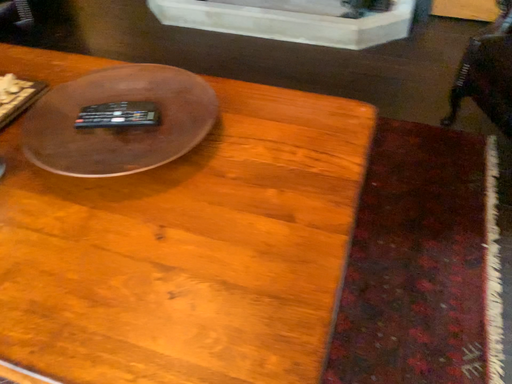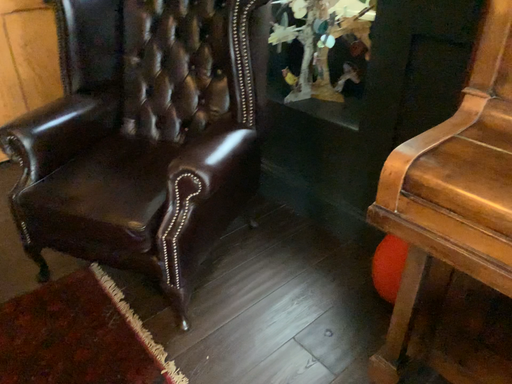
Question: How did the camera likely rotate when shooting the video?

Choices:
 (A) rotated right
 (B) rotated left

Answer: (A)